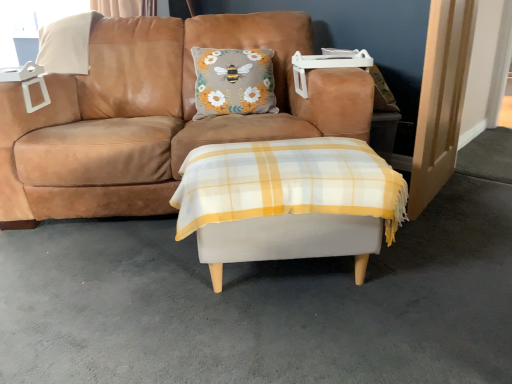
Identify the location of free point below light wood door at right (from a real-world perspective). (442, 201).